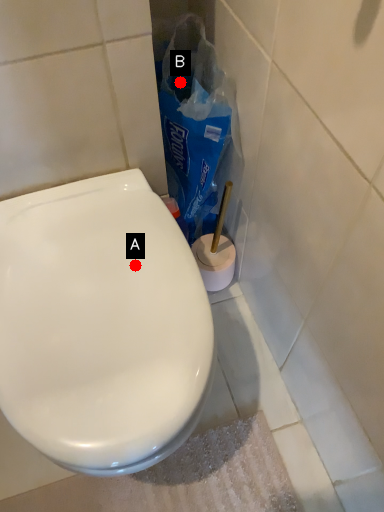
Question: Two points are circled on the image, labeled by A and B beside each circle. Among these points, which one is farthest from the camera?

Choices:
 (A) A is further
 (B) B is further

Answer: (B)